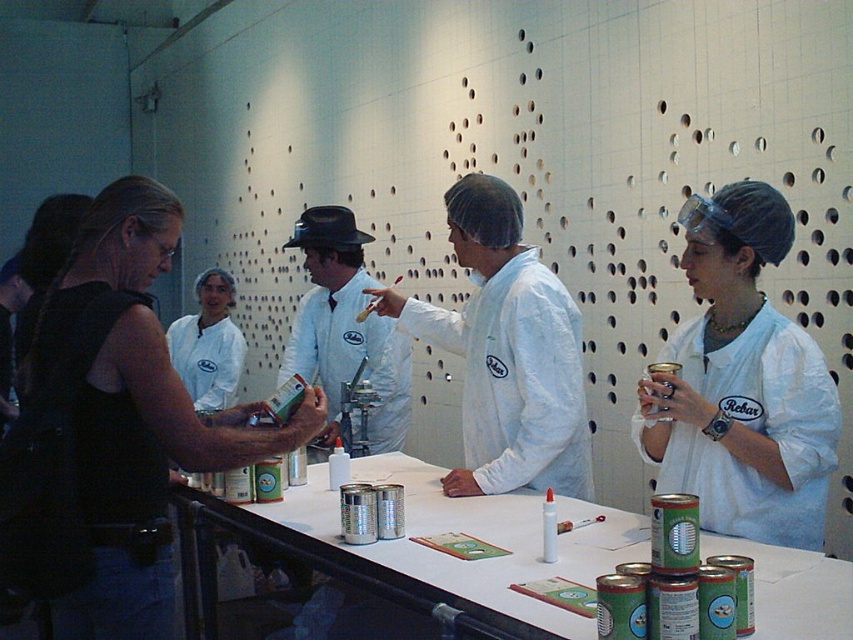
Consider the image. Can you confirm if white matte uniform at center is positioned to the right of white fabric shirt at center?

Indeed, white matte uniform at center is positioned on the right side of white fabric shirt at center.

Where is `white matte uniform at center`? The image size is (853, 640). white matte uniform at center is located at coordinates (345, 328).

Describe the element at coordinates (345, 328) in the screenshot. I see `white matte uniform at center` at that location.

Identify the location of white matte uniform at center. The image size is (853, 640). (345, 328).

Can you confirm if black fabric vest at left is positioned below white paper table at center?

No.

Based on the photo, who is more distant from viewer, (91, 637) or (488, 531)?

Positioned behind is point (488, 531).

Which is behind, point (137, 440) or point (781, 572)?

The point (137, 440) is behind.

Identify the location of black fabric vest at left. (134, 416).

Between white paper table at center and white lab coat at center, which one appears on the left side from the viewer's perspective?

white paper table at center is more to the left.

Which is in front, point (268, 512) or point (473, 493)?

Point (268, 512)

In the scene shown: Who is more forward, [570,557] or [590,486]?

Point [570,557]

Locate an element on the screen. The width and height of the screenshot is (853, 640). white paper table at center is located at coordinates (445, 554).